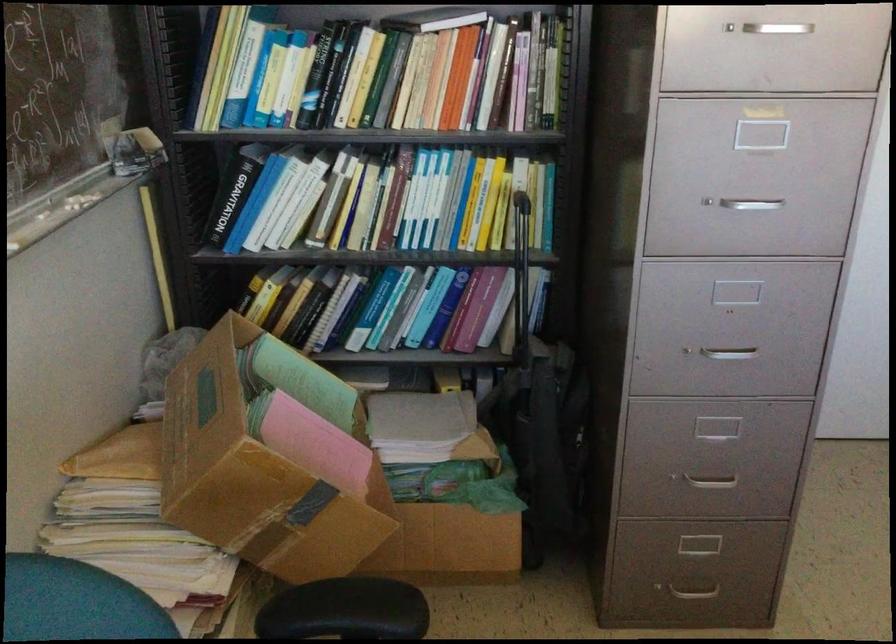
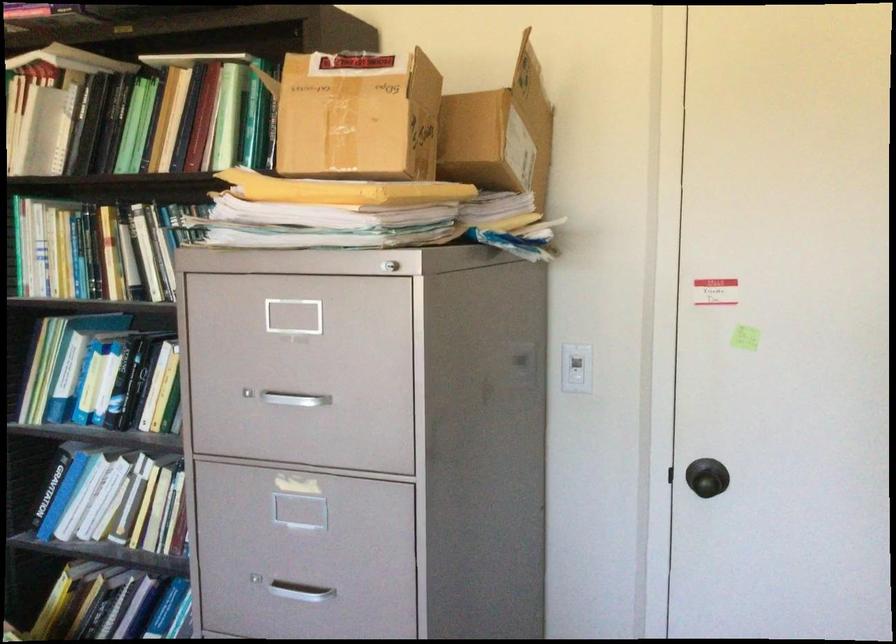
The point at [675,200] is marked in the first image. Where is the corresponding point in the second image?

(252, 574)